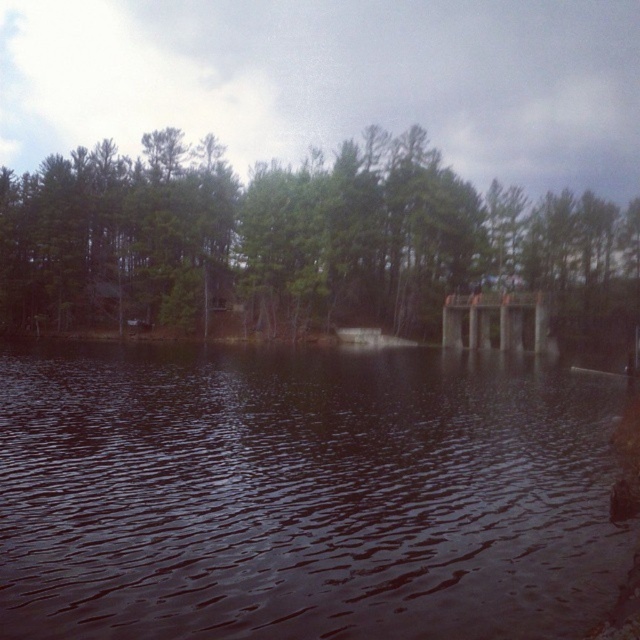
You are an environmental scientist assessing the scene. You need to determine which object, the dark reflective water at center or the green leafy trees at center, is closer to the observer. Based on their positions, which one would you say is nearer?

The dark reflective water at center is shorter than the green leafy trees at center, meaning the water is closer to the observer since it appears lower in the visual plane.

You are standing at the point marked as point (589, 413) in the image. A friend is located 30 meters away from you in the direction of the dam or bridge structure. Can your friend see the dam or bridge structure that is partially hidden by the trees?

The point (589, 413) is 29.08 meters away from the viewer. Since your friend is 30 meters away from you in the direction of the dam or bridge structure, they are approximately 59.08 meters away from the structure. However, the structure is partially obscured by trees, so it is unclear if your friend can see it clearly.

You are a photographer planning to capture the dark reflective water at center and the green leafy trees at center in a single frame. Which object will occupy more of the photo?

The green leafy trees at center will occupy more of the photo since the dark reflective water at center occupies less space than them according to the description.